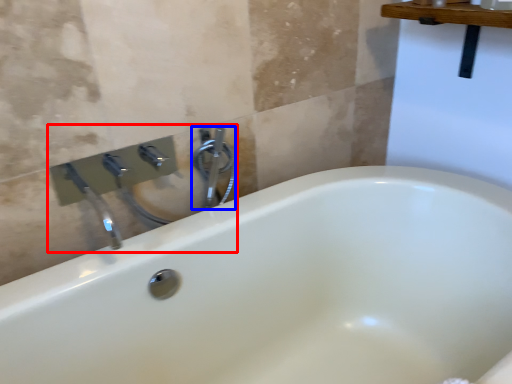
Question: Which of the following is the closest to the observer, sink (highlighted by a red box) or plumbing fixture (highlighted by a blue box)?

Choices:
 (A) sink
 (B) plumbing fixture

Answer: (A)